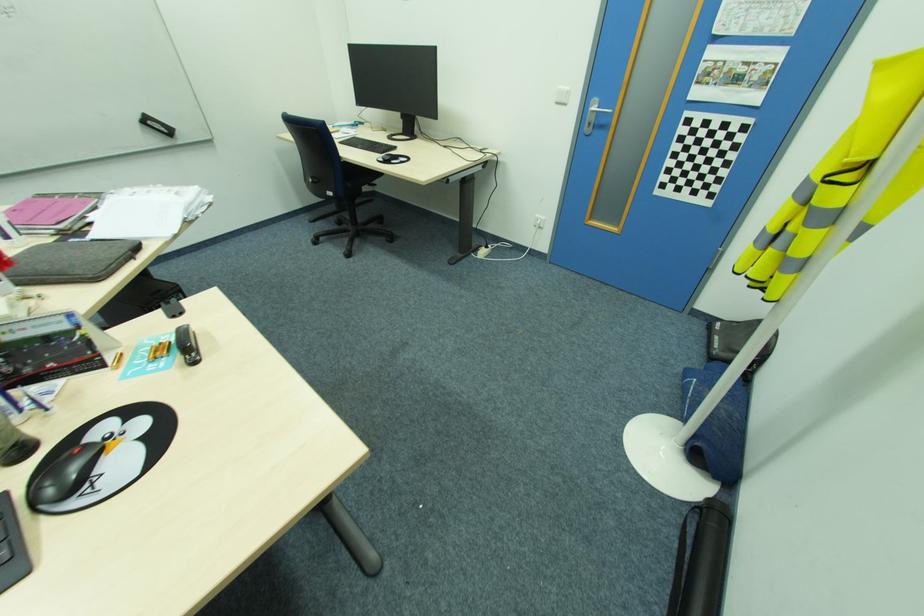
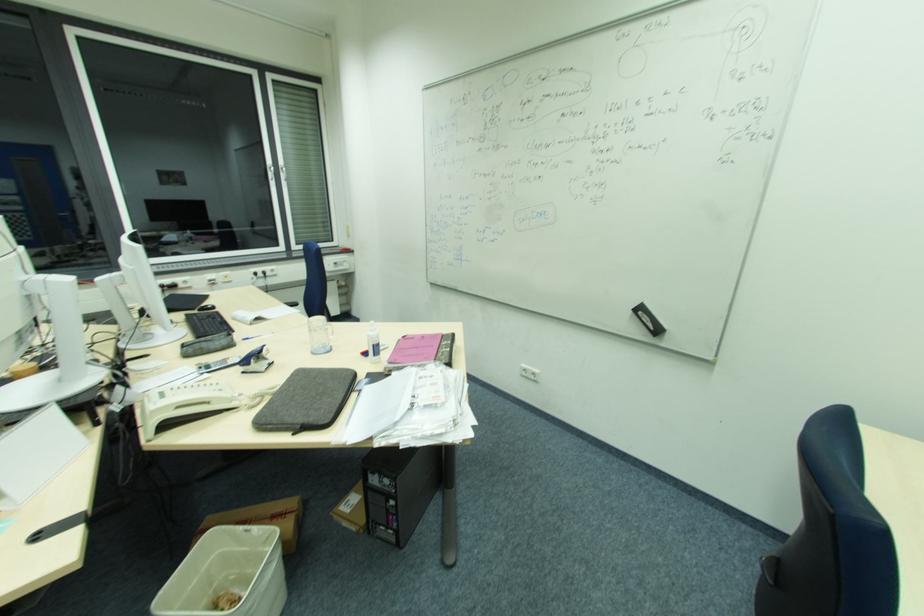
In the second image, find the point that corresponds to (x=151, y=123) in the first image.

(643, 314)